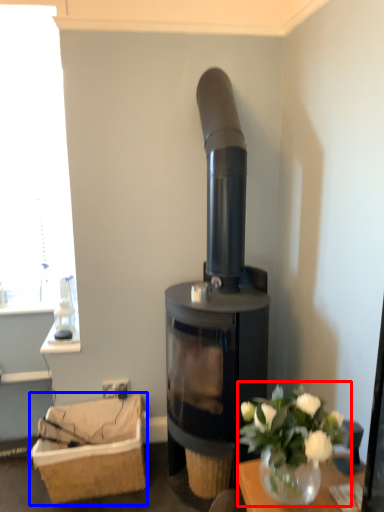
Question: Among these objects, which one is nearest to the camera, floral arrangement (highlighted by a red box) or basket (highlighted by a blue box)?

Choices:
 (A) floral arrangement
 (B) basket

Answer: (A)